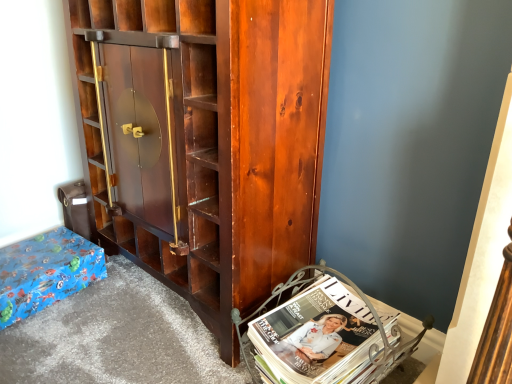
Question: From a real-world perspective, is blue wrapping paper at lower left physically above white glossy magazine at lower right?

Choices:
 (A) no
 (B) yes

Answer: (A)

Question: From the image's perspective, does blue wrapping paper at lower left appear higher than white glossy magazine at lower right?

Choices:
 (A) no
 (B) yes

Answer: (B)

Question: Can you confirm if blue wrapping paper at lower left is taller than white glossy magazine at lower right?

Choices:
 (A) yes
 (B) no

Answer: (B)

Question: Is blue wrapping paper at lower left in contact with white glossy magazine at lower right?

Choices:
 (A) yes
 (B) no

Answer: (B)

Question: Does blue wrapping paper at lower left have a smaller size compared to white glossy magazine at lower right?

Choices:
 (A) yes
 (B) no

Answer: (A)

Question: Does blue wrapping paper at lower left appear on the right side of white glossy magazine at lower right?

Choices:
 (A) no
 (B) yes

Answer: (A)

Question: From the image's perspective, is white glossy magazine at lower right above blue wrapping paper at lower left?

Choices:
 (A) no
 (B) yes

Answer: (A)

Question: Is white glossy magazine at lower right outside blue wrapping paper at lower left?

Choices:
 (A) yes
 (B) no

Answer: (A)

Question: From the image's perspective, is white glossy magazine at lower right located beneath blue wrapping paper at lower left?

Choices:
 (A) yes
 (B) no

Answer: (A)

Question: Is white glossy magazine at lower right at the left side of blue wrapping paper at lower left?

Choices:
 (A) no
 (B) yes

Answer: (A)

Question: Does white glossy magazine at lower right contain blue wrapping paper at lower left?

Choices:
 (A) yes
 (B) no

Answer: (B)

Question: Considering the relative positions of white glossy magazine at lower right and blue wrapping paper at lower left in the image provided, is white glossy magazine at lower right to the right of blue wrapping paper at lower left from the viewer's perspective?

Choices:
 (A) no
 (B) yes

Answer: (B)

Question: Would you say blue wrapping paper at lower left is outside shiny dark wood cabinet at center?

Choices:
 (A) no
 (B) yes

Answer: (B)